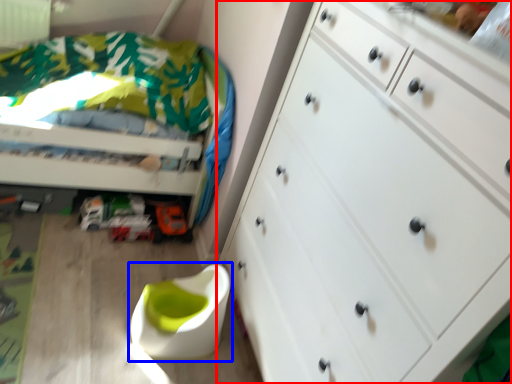
Question: Which object appears closest to the camera in this image, chest of drawers (highlighted by a red box) or swivel chair (highlighted by a blue box)?

Choices:
 (A) chest of drawers
 (B) swivel chair

Answer: (A)